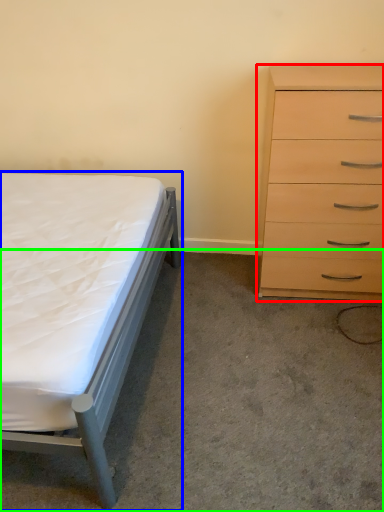
Question: Which object is positioned closest to chest of drawers (highlighted by a red box)? Select from bed (highlighted by a blue box) and concrete (highlighted by a green box).

Choices:
 (A) bed
 (B) concrete

Answer: (B)